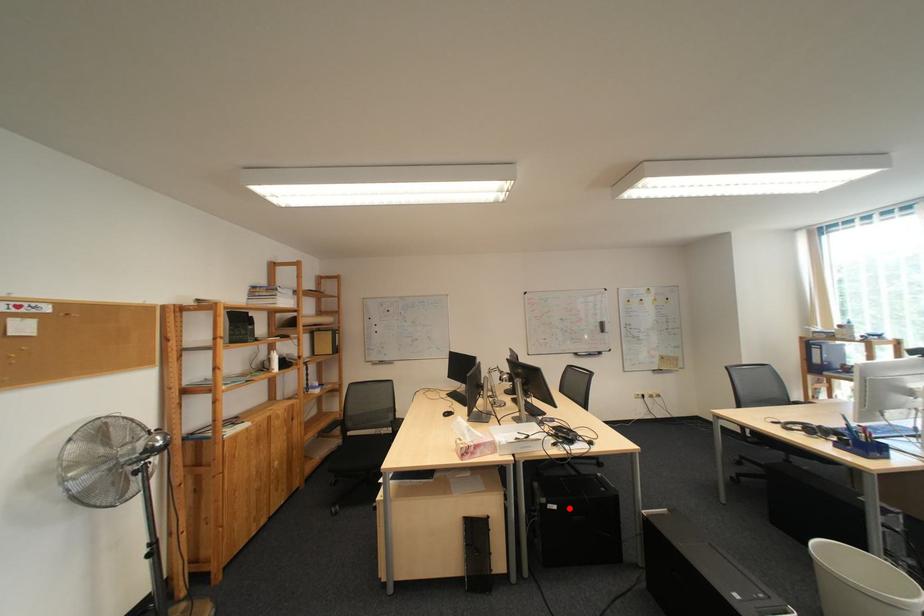
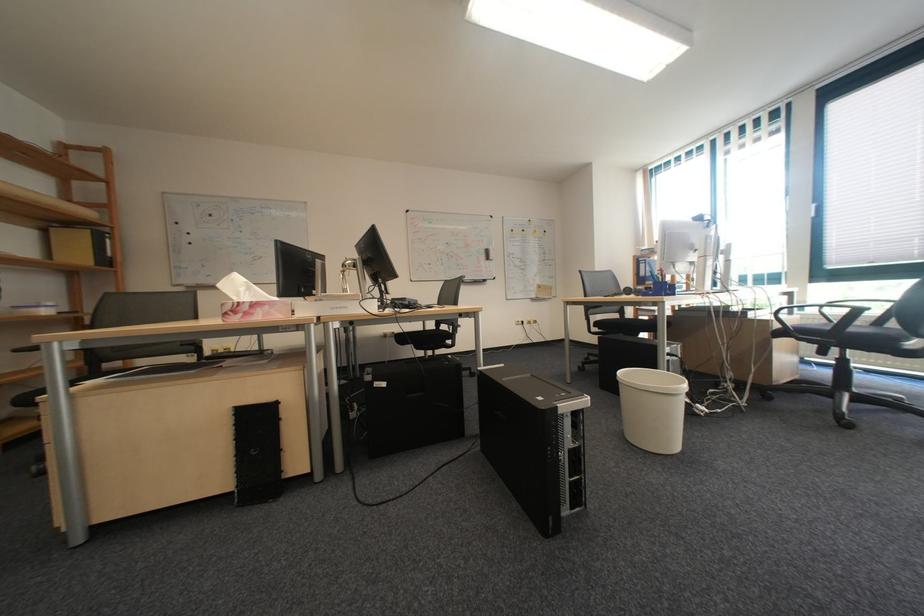
Question: I am providing you with two images of the same scene from different viewpoints. Image1 has a red point marked. In image2, the corresponding 3D location appears at what relative position? Reply with the corresponding letter.

Choices:
 (A) Closer
 (B) Farther

Answer: (B)